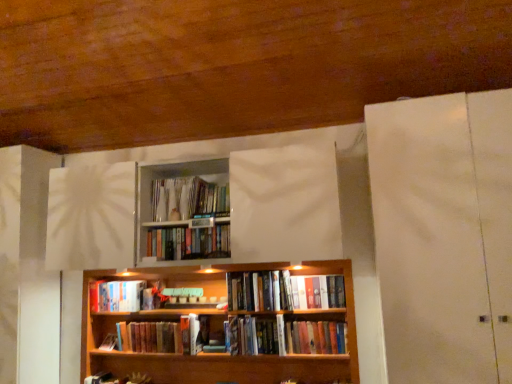
Question: Is there a large distance between hardcover book at center, acting as the first book starting from the bottom, and hardcover books at center, which ranks as the fourth book in bottom-to-top order?

Choices:
 (A) no
 (B) yes

Answer: (A)

Question: Is hardcover book at center, acting as the first book starting from the bottom, taller than hardcover books at center, which is counted as the fourth book, starting from the top?

Choices:
 (A) yes
 (B) no

Answer: (B)

Question: Does hardcover book at center, acting as the 7th book starting from the top, have a lesser height compared to hardcover books at center, which is counted as the fourth book, starting from the top?

Choices:
 (A) no
 (B) yes

Answer: (B)

Question: Is the depth of hardcover book at center, acting as the first book starting from the bottom, less than that of hardcover books at center, which ranks as the fourth book in bottom-to-top order?

Choices:
 (A) no
 (B) yes

Answer: (A)

Question: From a real-world perspective, is hardcover book at center, acting as the 7th book starting from the top, over hardcover books at center, which is counted as the fourth book, starting from the top?

Choices:
 (A) no
 (B) yes

Answer: (A)

Question: Is hardcover book at center, acting as the 7th book starting from the top, in contact with hardcover books at center, which ranks as the fourth book in bottom-to-top order?

Choices:
 (A) yes
 (B) no

Answer: (B)

Question: Can you confirm if hardcover books at center, which is the second book in bottom-to-top order, is positioned to the left of hardcover book at center, arranged as the 5th book when viewed from the top?

Choices:
 (A) no
 (B) yes

Answer: (A)

Question: From a real-world perspective, is hardcover books at center, the sixth book from the top, below hardcover book at center, arranged as the 5th book when viewed from the top?

Choices:
 (A) no
 (B) yes

Answer: (B)

Question: Is hardcover books at center, which is the second book in bottom-to-top order, smaller than hardcover book at center, arranged as the 5th book when viewed from the top?

Choices:
 (A) yes
 (B) no

Answer: (B)

Question: From the image's perspective, would you say hardcover books at center, the sixth book from the top, is positioned over hardcover book at center, positioned as the 3th book in bottom-to-top order?

Choices:
 (A) no
 (B) yes

Answer: (A)

Question: Considering the relative sizes of hardcover books at center, which is the second book in bottom-to-top order, and hardcover book at center, arranged as the 5th book when viewed from the top, in the image provided, is hardcover books at center, which is the second book in bottom-to-top order, taller than hardcover book at center, arranged as the 5th book when viewed from the top,?

Choices:
 (A) yes
 (B) no

Answer: (A)

Question: Is hardcover books at center, the sixth book from the top, positioned before hardcover book at center, arranged as the 5th book when viewed from the top?

Choices:
 (A) yes
 (B) no

Answer: (A)

Question: Could you tell me if hardcover book at center, arranged as the 5th book when viewed from the top, is facing hardcover books at center, the 6th book positioned from the bottom?

Choices:
 (A) yes
 (B) no

Answer: (B)